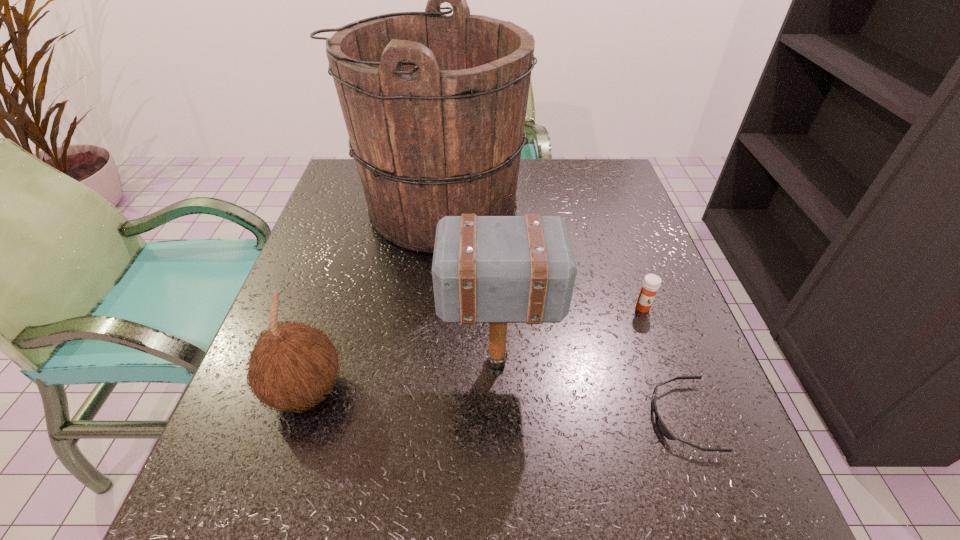
Image resolution: width=960 pixels, height=540 pixels. In order to click on the tallest object in this screenshot , I will do `click(434, 105)`.

In order to click on the farthest object in this screenshot , I will do point(434,105).

Find the location of a particular element. This screenshot has width=960, height=540. the second tallest object is located at coordinates pyautogui.click(x=486, y=269).

Identify the location of the third shortest object. (292, 365).

Find the location of a particular element. The image size is (960, 540). the fourth tallest object is located at coordinates (651, 283).

Locate an element on the screen. This screenshot has height=540, width=960. medicine is located at coordinates (651, 283).

Find the location of a particular element. The height and width of the screenshot is (540, 960). sunglasses is located at coordinates (660, 425).

This screenshot has width=960, height=540. What are the coordinates of `free space located 0.210m on the front of the bucket` in the screenshot? It's located at (420, 337).

Where is `free location located 0.310m on the striking surface of the fourth shortest object`? free location located 0.310m on the striking surface of the fourth shortest object is located at coordinates (273, 362).

This screenshot has height=540, width=960. I want to click on free region located on the striking surface of the fourth shortest object, so coord(384,362).